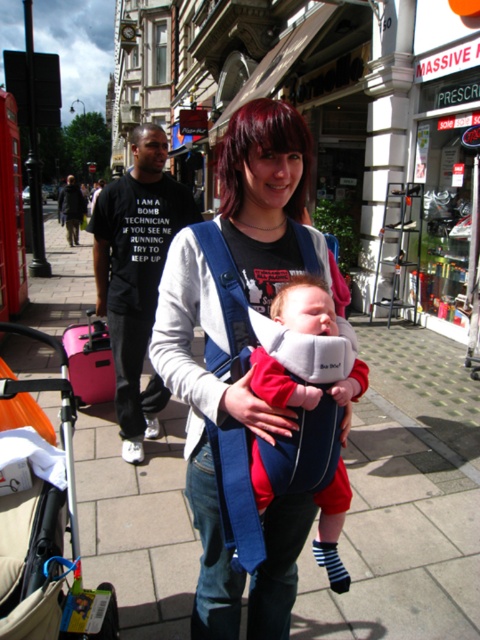
Does point (133, 595) come farther from viewer compared to point (264, 625)?

Yes.

Find the location of a particular element. paved stone sidewalk at center is located at coordinates (405, 499).

What do you see at coordinates (405, 499) in the screenshot?
I see `paved stone sidewalk at center` at bounding box center [405, 499].

Which is behind, point (87, 237) or point (285, 440)?

The point (87, 237) is behind.

This screenshot has height=640, width=480. What are the coordinates of `paved stone sidewalk at center` in the screenshot? It's located at (405, 499).

Is paved stone sidewalk at center above pink fabric baby carriage at lower left?

Correct, paved stone sidewalk at center is located above pink fabric baby carriage at lower left.

Is paved stone sidewalk at center positioned in front of pink fabric baby carriage at lower left?

No, paved stone sidewalk at center is further to the viewer.

Who is more distant from viewer, (x=395, y=337) or (x=63, y=392)?

The point (x=395, y=337) is more distant.

Locate an element on the screen. The width and height of the screenshot is (480, 640). paved stone sidewalk at center is located at coordinates (405, 499).